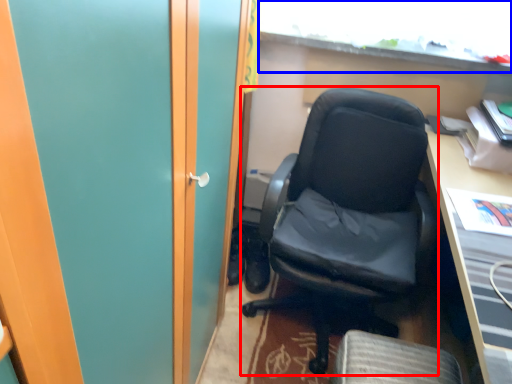
Question: Which point is closer to the camera, chair (highlighted by a red box) or window (highlighted by a blue box)?

Choices:
 (A) chair
 (B) window

Answer: (A)